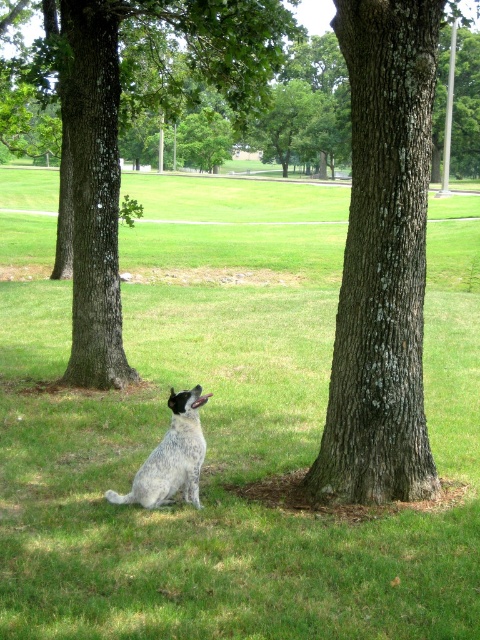
How distant is green grass at center from brown rough tree at center?

58.35 feet

Consider the image. Which of these two, green grass at center or brown rough tree at center, stands shorter?

brown rough tree at center is shorter.

Between point (282, 300) and point (98, 227), which one is positioned behind?

The point (282, 300) is behind.

Identify the location of green grass at center. (228, 440).

Consider the image. Can you confirm if smooth bark tree at center is positioned to the right of brown rough tree at center?

Indeed, smooth bark tree at center is positioned on the right side of brown rough tree at center.

Who is more forward, (392, 116) or (113, 189)?

Positioned in front is point (392, 116).

What are the coordinates of `smooth bark tree at center` in the screenshot? It's located at (382, 260).

You are a GUI agent. You are given a task and a screenshot of the screen. Output one action in this format:
    pyautogui.click(x=<x>, y=<y>)
    Task: Click on the green grass at center
    This screenshot has width=480, height=640.
    Given the screenshot: What is the action you would take?
    pyautogui.click(x=228, y=440)

Who is more forward, (300,588) or (156,474)?

Point (300,588) is more forward.

Where is `green grass at center`? green grass at center is located at coordinates (228, 440).